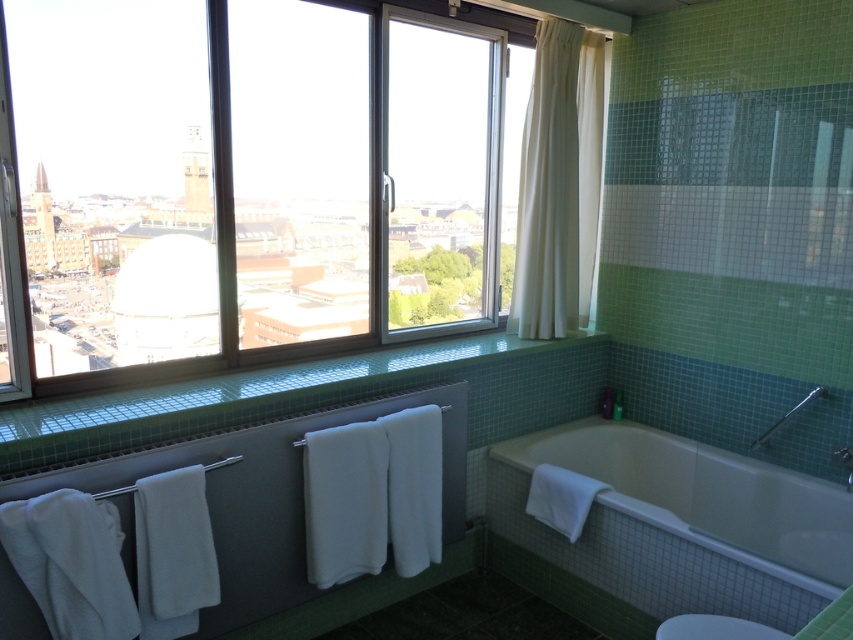
You are designing a bathroom layout and need to know the relative sizes of the white glossy bathtub at lower right and the white fabric curtain at upper center. Which one is bigger?

The white glossy bathtub at lower right is larger in size than the white fabric curtain at upper center.

You are designing a bathroom layout and need to place a new decorative item. The item must be placed between the white fabric curtain at upper center and the white glossy toilet bowl at lower right. Considering their sizes, which object should the item be placed closer to?

The item should be placed closer to the white glossy toilet bowl at lower right because the white fabric curtain at upper center is bigger and might require more space around it.